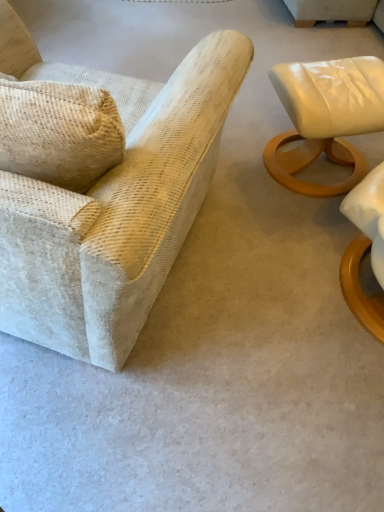
Find the location of a particular element. This screenshot has width=384, height=512. free space in front of matte white leather ottoman at right, the second chair viewed from the left is located at coordinates (292, 228).